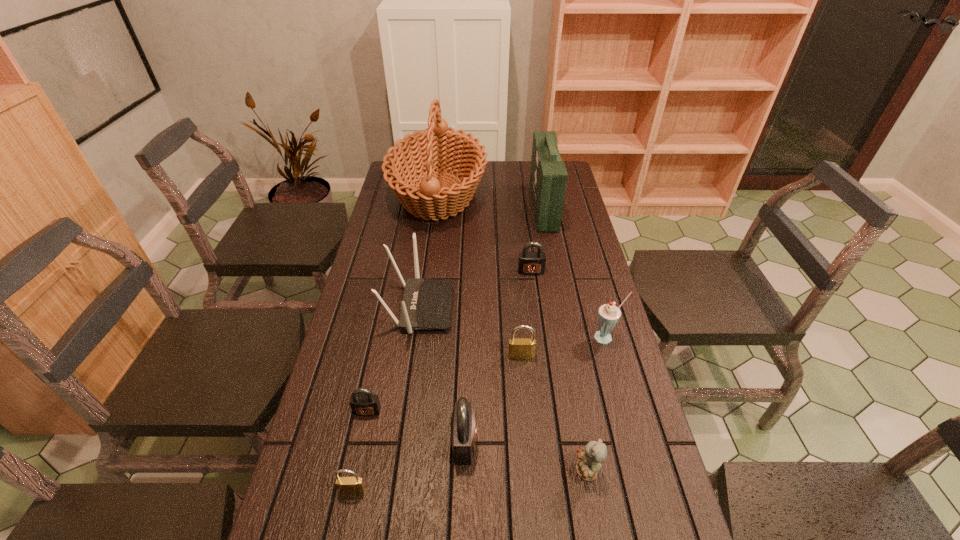
The width and height of the screenshot is (960, 540). In order to click on the fourth nearest padlock in this screenshot , I will do `click(519, 348)`.

This screenshot has width=960, height=540. I want to click on the sixth farthest object, so click(519, 348).

The width and height of the screenshot is (960, 540). In order to click on blue teddy bear in this screenshot , I will do `click(594, 453)`.

The height and width of the screenshot is (540, 960). I want to click on the fourth nearest object, so tap(363, 402).

This screenshot has height=540, width=960. What are the coordinates of `the third nearest padlock` in the screenshot? It's located at (363, 402).

The image size is (960, 540). What are the coordinates of `the smaller brass padlock` in the screenshot? It's located at (346, 485).

This screenshot has width=960, height=540. I want to click on the nearer brass padlock, so click(346, 485).

Where is `vacant space positioned 0.180m on the front of the basket`? vacant space positioned 0.180m on the front of the basket is located at coordinates click(x=428, y=269).

The width and height of the screenshot is (960, 540). I want to click on free location located on the front-facing side of the second tallest object, so click(x=431, y=207).

The height and width of the screenshot is (540, 960). Identify the location of blank area located on the front-facing side of the second tallest object. (431, 207).